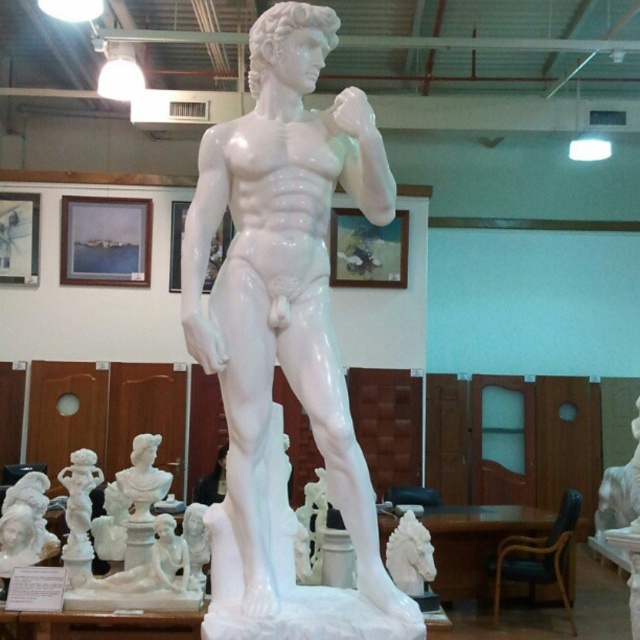
You are standing in front of the marble sculpture and want to touch both points on the statue. Which point, point (292, 236) or point (637, 470), will you reach first?

Point (292, 236) is closer to the viewer than point (637, 470), so you will reach point (292, 236) first.

You are standing in front of the white marble sculpture of a muscular male figure. You want to take a photo of the point at coordinates point (298, 346). If your camera is 6.49 feet away from the point, can you capture the entire sculpture in the frame?

The point (298, 346) is 6.49 feet away from the camera, so yes, you can capture the entire sculpture in the frame since the distance matches the required focal length.

You are an art curator planning to display two white marble busts in a gallery. The white marble bust at lower left and the white marble bust at right need to be arranged according to their sizes. Which one should be placed on a higher pedestal to ensure both are visible to visitors?

The white marble bust at lower left is shorter than the white marble bust at right, so placing the shorter one on a higher pedestal will ensure both are visible to visitors.